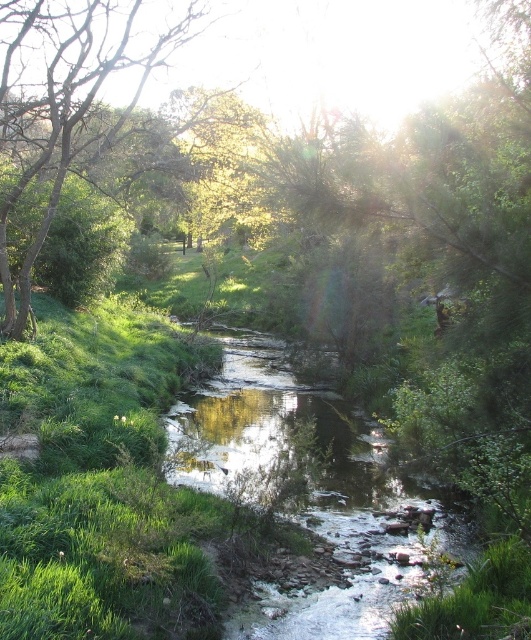
Between point (371, 584) and point (18, 324), which one is positioned behind?

Point (18, 324)

Is clear water stream at center bigger than green leafy tree at left?

Incorrect, clear water stream at center is not larger than green leafy tree at left.

I want to click on clear water stream at center, so click(310, 490).